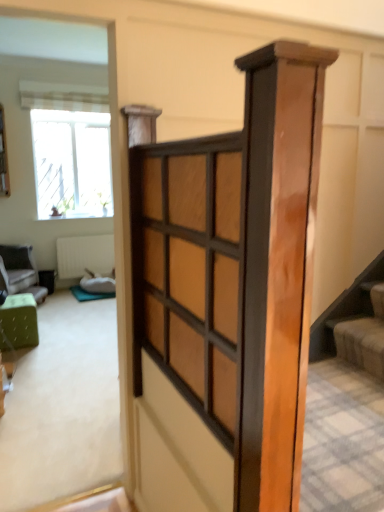
Question: Considering the relative positions of striped fabric curtain at upper left and white textured radiator at center in the image provided, is striped fabric curtain at upper left to the right of white textured radiator at center from the viewer's perspective?

Choices:
 (A) no
 (B) yes

Answer: (B)

Question: Can you confirm if striped fabric curtain at upper left is wider than white textured radiator at center?

Choices:
 (A) yes
 (B) no

Answer: (A)

Question: Is striped fabric curtain at upper left closer to the viewer compared to white textured radiator at center?

Choices:
 (A) yes
 (B) no

Answer: (A)

Question: From the image's perspective, would you say striped fabric curtain at upper left is positioned over white textured radiator at center?

Choices:
 (A) no
 (B) yes

Answer: (B)

Question: Is striped fabric curtain at upper left turned away from white textured radiator at center?

Choices:
 (A) no
 (B) yes

Answer: (A)

Question: Does point (31, 86) appear closer or farther from the camera than point (102, 262)?

Choices:
 (A) closer
 (B) farther

Answer: (A)

Question: Based on their sizes in the image, would you say striped fabric curtain at upper left is bigger or smaller than white textured radiator at center?

Choices:
 (A) big
 (B) small

Answer: (A)

Question: In terms of height, does striped fabric curtain at upper left look taller or shorter compared to white textured radiator at center?

Choices:
 (A) short
 (B) tall

Answer: (A)

Question: Is striped fabric curtain at upper left in front of or behind white textured radiator at center in the image?

Choices:
 (A) behind
 (B) front

Answer: (B)

Question: From the image's perspective, is wooden barn door at center above or below green fabric ottoman at left, which is the first furniture in right-to-left order?

Choices:
 (A) below
 (B) above

Answer: (B)

Question: From a real-world perspective, is wooden barn door at center above or below green fabric ottoman at left, which is the first furniture in right-to-left order?

Choices:
 (A) above
 (B) below

Answer: (A)

Question: In the image, is wooden barn door at center positioned in front of or behind green fabric ottoman at left, which is counted as the second furniture, starting from the back?

Choices:
 (A) behind
 (B) front

Answer: (B)

Question: Based on their sizes in the image, would you say wooden barn door at center is bigger or smaller than green fabric ottoman at left, which is counted as the second furniture, starting from the back?

Choices:
 (A) big
 (B) small

Answer: (B)

Question: From a real-world perspective, is soft beige carpet at lower right physically located above or below clear glass window at upper left?

Choices:
 (A) below
 (B) above

Answer: (A)

Question: Considering the positions of soft beige carpet at lower right and clear glass window at upper left in the image, is soft beige carpet at lower right bigger or smaller than clear glass window at upper left?

Choices:
 (A) small
 (B) big

Answer: (A)